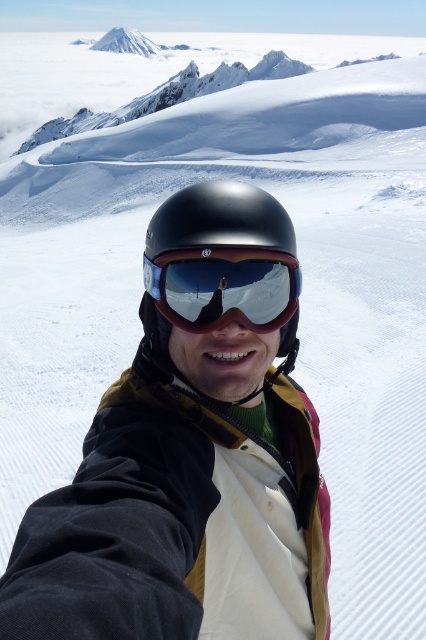
Describe the element at coordinates (221, 266) in the screenshot. I see `matte black helmet at center` at that location.

Who is positioned more to the right, matte black helmet at center or glossy reflective goggles at center?

Positioned to the right is glossy reflective goggles at center.

Locate an element on the screen. This screenshot has width=426, height=640. matte black helmet at center is located at coordinates (221, 266).